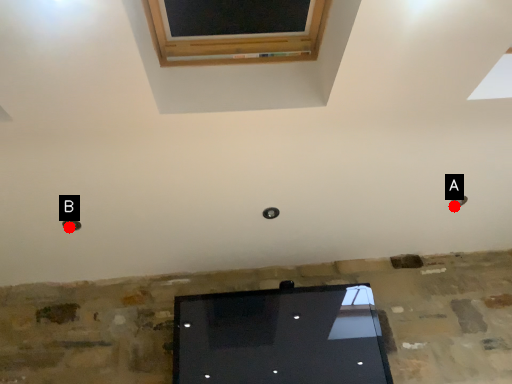
Question: Two points are circled on the image, labeled by A and B beside each circle. Which point appears closest to the camera in this image?

Choices:
 (A) A is closer
 (B) B is closer

Answer: (B)